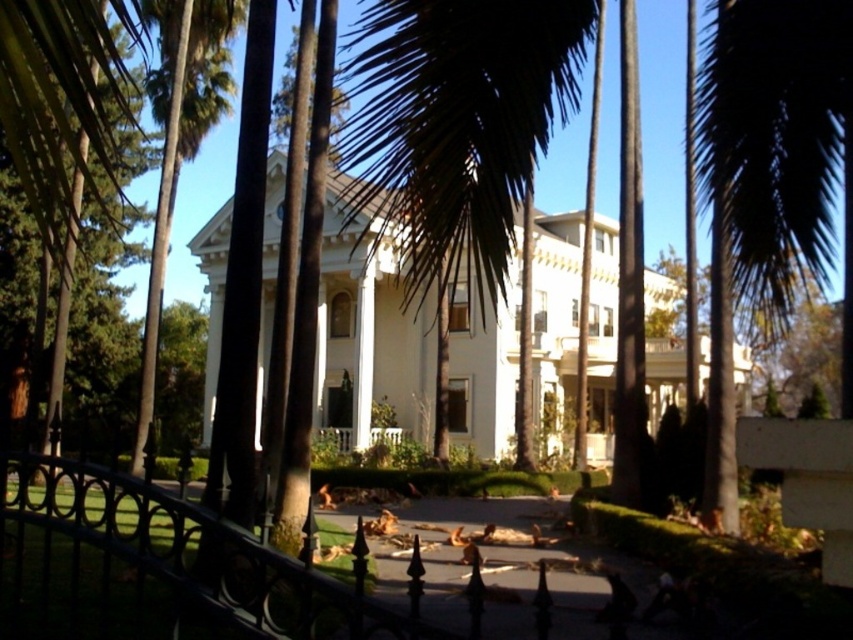
You are a photographer planning to capture the white glossy mansion at center and the dark green leafy palm tree at center in a single shot. Based on their heights, which one would appear larger in the photo?

The white glossy mansion at center appears larger in the photo because it is much taller than the dark green leafy palm tree at center.

You are standing in front of the house and notice two points marked on the image. The first point is at coordinates point (349, 324) and the second is at point (776, 12). Which point is closer to you?

Point (349, 324) is closer to you because it is further to the viewer than point (776, 12).

You are standing at point A, which is located at coordinates (368, 339). What structure can you see directly in front of you?

At point A located at coordinates (368, 339), you can see the white glossy mansion at center directly in front of you.